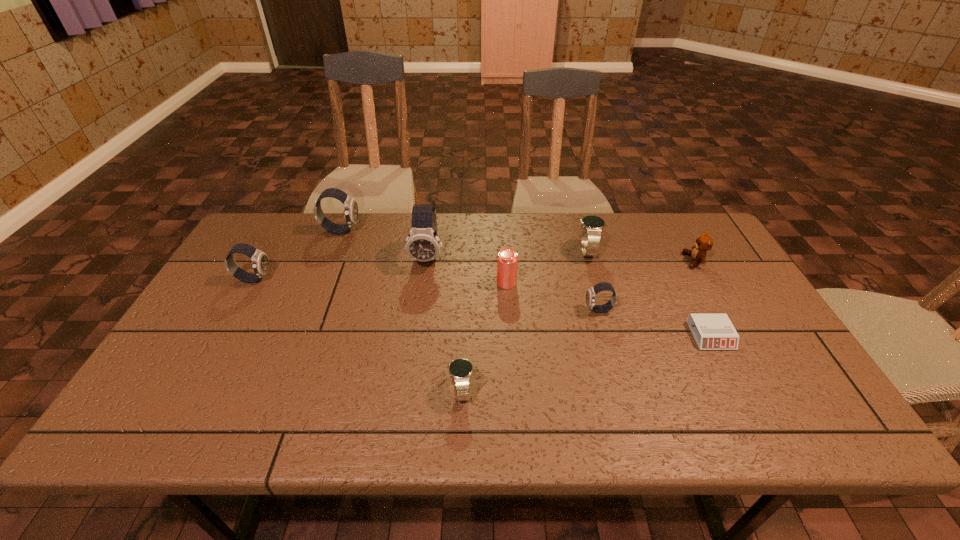
Locate an element on the screen. the rightmost dark watch is located at coordinates (591, 293).

Where is `the smallest dark watch`? The image size is (960, 540). the smallest dark watch is located at coordinates click(x=591, y=293).

Image resolution: width=960 pixels, height=540 pixels. I want to click on the nearest watch, so click(460, 370).

Find the location of `the left blue watch`. the left blue watch is located at coordinates (460, 370).

This screenshot has width=960, height=540. I want to click on alarm clock, so click(x=711, y=331).

The image size is (960, 540). I want to click on the shortest object, so click(x=711, y=331).

The width and height of the screenshot is (960, 540). I want to click on vacant space situated on the face of the tallest watch, so click(x=422, y=298).

At what (x,y) coordinates should I click in order to perform the action: click on vacant space located 0.240m on the face of the second tallest object. Please return your answer as a coordinate pair (x, y). The width and height of the screenshot is (960, 540). Looking at the image, I should click on (432, 230).

This screenshot has height=540, width=960. Find the location of `vacant space positioned on the face of the third biggest dark watch`. vacant space positioned on the face of the third biggest dark watch is located at coordinates (302, 279).

You are a GUI agent. You are given a task and a screenshot of the screen. Output one action in this format:
    pyautogui.click(x=<x>, y=<y>)
    Task: Click on the vacant point located on the right of the right blue watch
    
    Given the screenshot: What is the action you would take?
    pyautogui.click(x=636, y=251)